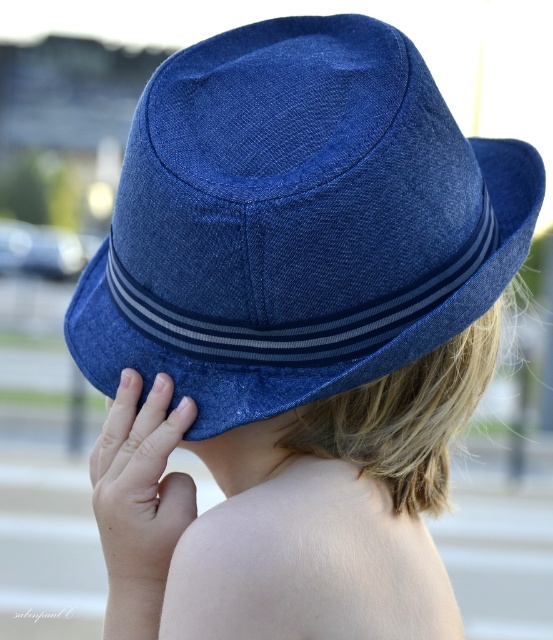
Question: Is denim blue fedora at back positioned before matte blue hat at upper center?

Choices:
 (A) no
 (B) yes

Answer: (B)

Question: Is denim blue fedora at back behind matte blue hat at upper center?

Choices:
 (A) no
 (B) yes

Answer: (A)

Question: Which object appears farthest from the camera in this image?

Choices:
 (A) matte blue hat at upper center
 (B) denim blue fedora at back

Answer: (A)

Question: Is denim blue fedora at back wider than matte blue hat at upper center?

Choices:
 (A) no
 (B) yes

Answer: (B)